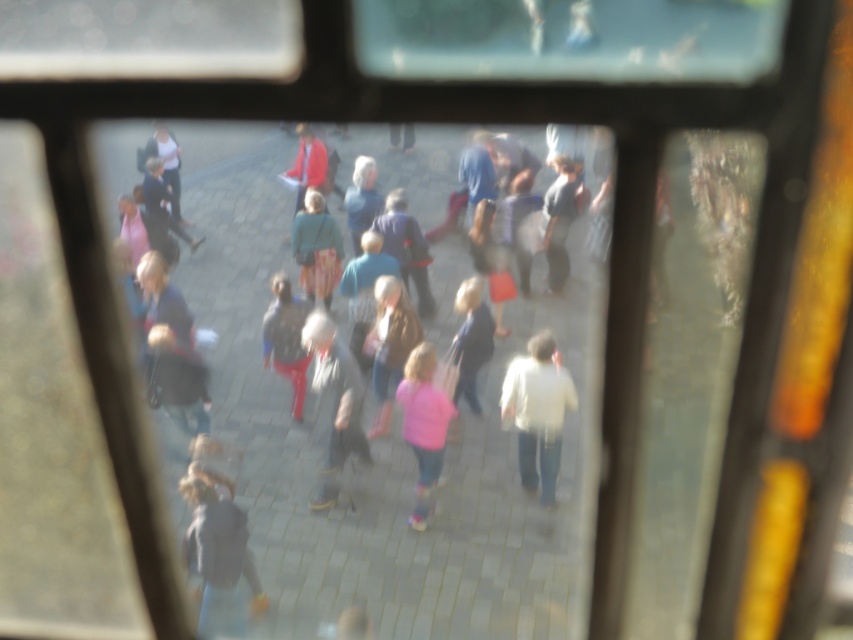
Question: Is gray fabric jacket at center thinner than matte gray jacket at center?

Choices:
 (A) yes
 (B) no

Answer: (B)

Question: Is light pink fabric at center to the left of matte red jacket at center from the viewer's perspective?

Choices:
 (A) no
 (B) yes

Answer: (A)

Question: Which point is farther to the camera?

Choices:
 (A) click(x=556, y=157)
 (B) click(x=161, y=147)

Answer: (B)

Question: Which object is closer to the camera taking this photo?

Choices:
 (A) matte gray jacket at center
 (B) light pink fabric at center
 (C) gray fabric jacket at center
 (D) matte black jacket at center

Answer: (A)

Question: Does matte green jacket at center lie in front of light pink fabric at center?

Choices:
 (A) yes
 (B) no

Answer: (A)

Question: Which of the following is the closest to the observer?

Choices:
 (A) gray fabric jacket at center
 (B) white matte shirt at center

Answer: (B)